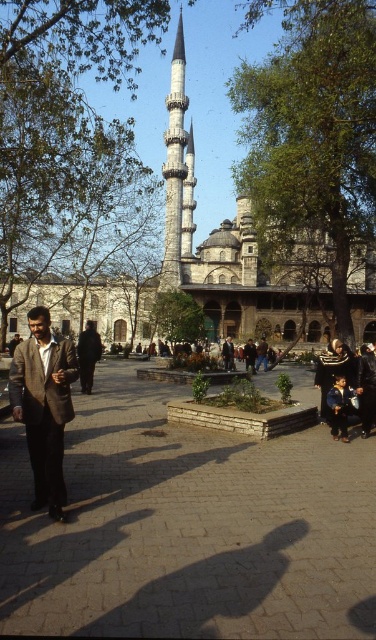
Can you confirm if white stone minaret at center is wider than dark gray suit at center?

Indeed, white stone minaret at center has a greater width compared to dark gray suit at center.

Which is in front, point (180, 29) or point (80, 344)?

Positioned in front is point (80, 344).

Who is more forward, [178,173] or [87,340]?

Positioned in front is point [87,340].

At what (x,y) coordinates should I click in order to perform the action: click on white stone minaret at center. Please return your answer as a coordinate pair (x, y). Looking at the image, I should click on (177, 172).

Is point (48, 493) in front of point (94, 337)?

Yes, it is in front of point (94, 337).

Locate an element on the screen. matte brown suit at left is located at coordinates (43, 404).

Where is `matte brown suit at left`? The width and height of the screenshot is (376, 640). matte brown suit at left is located at coordinates (43, 404).

From the picture: Does brick pavement at center appear on the right side of matte brown suit at left?

Yes, brick pavement at center is to the right of matte brown suit at left.

Between brick pavement at center and matte brown suit at left, which one appears on the right side from the viewer's perspective?

From the viewer's perspective, brick pavement at center appears more on the right side.

Does point (113, 513) come closer to viewer compared to point (12, 371)?

Yes, it is.

Where is `brick pavement at center`? Image resolution: width=376 pixels, height=640 pixels. brick pavement at center is located at coordinates (188, 528).